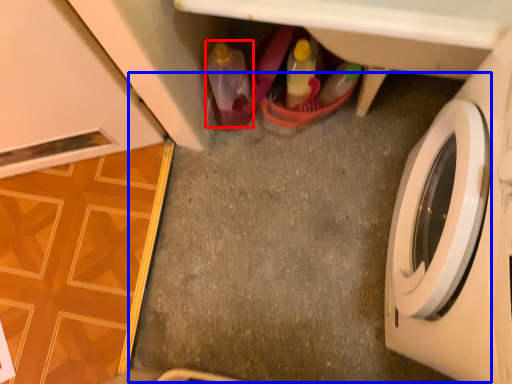
Question: Which of the following is the farthest to the observer, bottle (highlighted by a red box) or concrete (highlighted by a blue box)?

Choices:
 (A) bottle
 (B) concrete

Answer: (B)